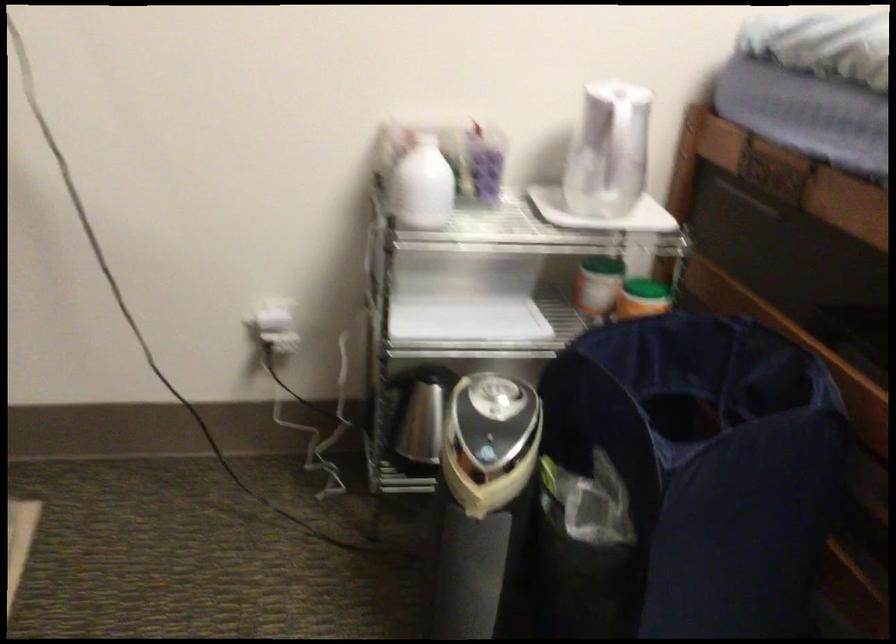
Identify the location of silver kettle handle. (607, 151).